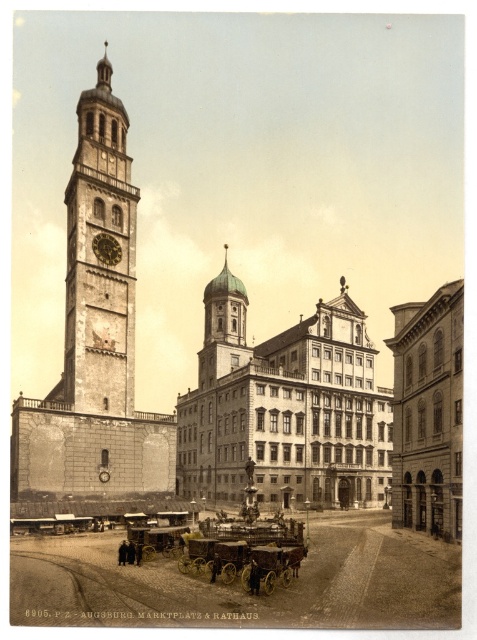
Is smooth stone church at center wider than brass clock at center-left?

Indeed, smooth stone church at center has a greater width compared to brass clock at center-left.

Which of these two, smooth stone church at center or brass clock at center-left, stands taller?

smooth stone church at center is taller.

Is point (385, 452) positioned before point (109, 234)?

No, (385, 452) is further to viewer.

Identify the location of smooth stone church at center. The image size is (477, 640). (284, 408).

Locate an element on the screen. The width and height of the screenshot is (477, 640). smooth stone church at center is located at coordinates [284, 408].

Does point (227, 481) lie behind point (87, 221)?

Yes, it is.

Identify the location of smooth stone church at center. (284, 408).

Does smooth stone tower at left lie in front of brass clock at center-left?

That is True.

Which is in front, point (100, 186) or point (106, 256)?

Point (106, 256) is more forward.

I want to click on smooth stone tower at left, so click(x=97, y=260).